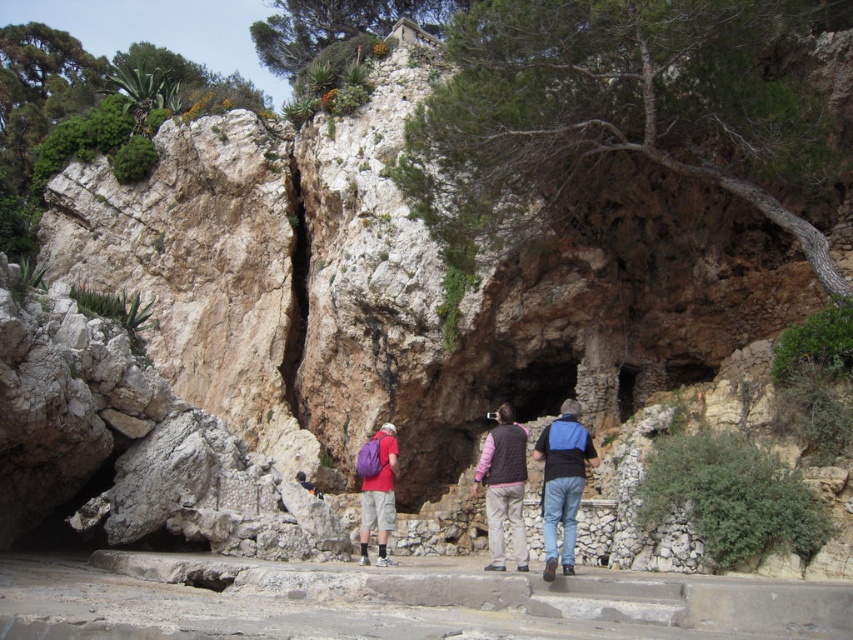
Is point (561, 528) farther from camera compared to point (498, 445)?

No, it is not.

Identify the location of blue fabric backpack at center. (561, 483).

Looking at this image, is pink fleece vest at center thinner than purple fabric backpack at center?

Yes.

Who is more forward, (494, 509) or (383, 460)?

Point (494, 509)

Identify the location of pink fleece vest at center. (503, 486).

Does blue fabric backpack at center have a greater width compared to purple fabric backpack at center?

Yes.

Between blue fabric backpack at center and purple fabric backpack at center, which one has more height?

Standing taller between the two is blue fabric backpack at center.

Does point (567, 480) come in front of point (380, 499)?

Yes.

Locate an element on the screen. Image resolution: width=853 pixels, height=640 pixels. blue fabric backpack at center is located at coordinates (561, 483).